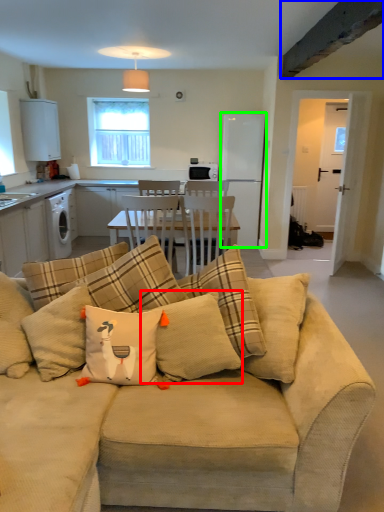
Question: Which object is the closest to the pillow (highlighted by a red box)? Choose among these: exhaust hood (highlighted by a blue box) or appliance (highlighted by a green box).

Choices:
 (A) exhaust hood
 (B) appliance

Answer: (A)